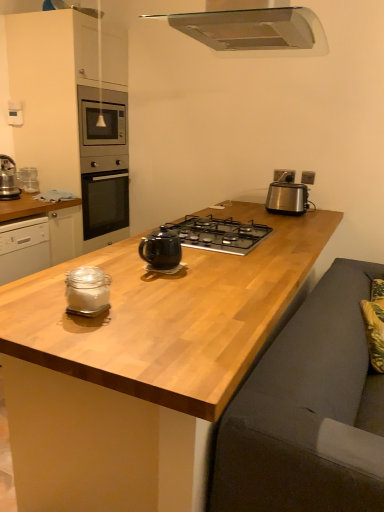
Question: Would you say satin silver toaster at right contains clear glass jar at left, the second cabinetry in the top-to-bottom sequence?

Choices:
 (A) yes
 (B) no

Answer: (B)

Question: Can you confirm if satin silver toaster at right is wider than clear glass jar at left, which appears as the 1th cabinetry when ordered from the bottom?

Choices:
 (A) yes
 (B) no

Answer: (B)

Question: Considering the relative sizes of satin silver toaster at right and clear glass jar at left, the second cabinetry in the top-to-bottom sequence, in the image provided, is satin silver toaster at right thinner than clear glass jar at left, the second cabinetry in the top-to-bottom sequence,?

Choices:
 (A) yes
 (B) no

Answer: (A)

Question: Is satin silver toaster at right outside clear glass jar at left, the second cabinetry in the top-to-bottom sequence?

Choices:
 (A) yes
 (B) no

Answer: (A)

Question: Considering the relative sizes of satin silver toaster at right and clear glass jar at left, the second cabinetry in the top-to-bottom sequence, in the image provided, is satin silver toaster at right bigger than clear glass jar at left, the second cabinetry in the top-to-bottom sequence,?

Choices:
 (A) no
 (B) yes

Answer: (A)

Question: Considering the relative sizes of satin silver toaster at right and clear glass jar at left, which appears as the 1th cabinetry when ordered from the bottom, in the image provided, is satin silver toaster at right taller than clear glass jar at left, which appears as the 1th cabinetry when ordered from the bottom,?

Choices:
 (A) no
 (B) yes

Answer: (A)

Question: From the image's perspective, is satin silver toaster at upper right, the 2th electric outlet positioned from the right, on top of black glass gas stove at center?

Choices:
 (A) no
 (B) yes

Answer: (B)

Question: From the image's perspective, is satin silver toaster at upper right, which is the 1th electric outlet in left-to-right order, below black glass gas stove at center?

Choices:
 (A) yes
 (B) no

Answer: (B)

Question: Is there a large distance between satin silver toaster at upper right, which is the 1th electric outlet in left-to-right order, and black glass gas stove at center?

Choices:
 (A) yes
 (B) no

Answer: (B)

Question: Is satin silver toaster at upper right, the 2th electric outlet positioned from the right, located outside black glass gas stove at center?

Choices:
 (A) yes
 (B) no

Answer: (A)

Question: Considering the relative positions of satin silver toaster at upper right, which is the 1th electric outlet in left-to-right order, and black glass gas stove at center in the image provided, is satin silver toaster at upper right, which is the 1th electric outlet in left-to-right order, to the left of black glass gas stove at center from the viewer's perspective?

Choices:
 (A) yes
 (B) no

Answer: (B)

Question: From a real-world perspective, is satin silver toaster at upper right, the 2th electric outlet positioned from the right, physically below black glass gas stove at center?

Choices:
 (A) yes
 (B) no

Answer: (B)

Question: From the image's perspective, would you say metallic stainless steel range hood at upper center is shown under wooden at center?

Choices:
 (A) no
 (B) yes

Answer: (A)